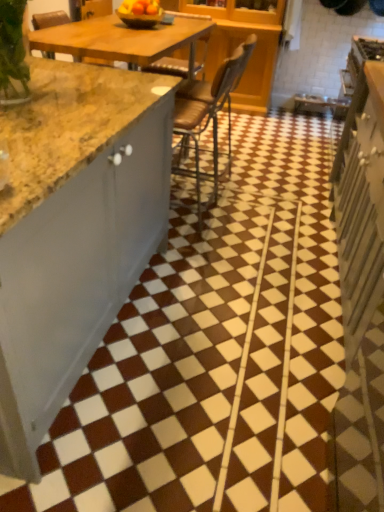
Question: Considering the relative positions of brown leather chair at center and matte yellow bowl at upper center in the image provided, is brown leather chair at center to the left of matte yellow bowl at upper center from the viewer's perspective?

Choices:
 (A) no
 (B) yes

Answer: (A)

Question: Are brown leather chair at center and matte yellow bowl at upper center far apart?

Choices:
 (A) no
 (B) yes

Answer: (B)

Question: Does brown leather chair at center have a lesser height compared to matte yellow bowl at upper center?

Choices:
 (A) no
 (B) yes

Answer: (A)

Question: From the image's perspective, would you say brown leather chair at center is shown under matte yellow bowl at upper center?

Choices:
 (A) no
 (B) yes

Answer: (B)

Question: Does brown leather chair at center have a smaller size compared to matte yellow bowl at upper center?

Choices:
 (A) yes
 (B) no

Answer: (B)

Question: Does brown leather chair at center have a lesser width compared to matte yellow bowl at upper center?

Choices:
 (A) no
 (B) yes

Answer: (A)

Question: Is brown glossy tile at center aimed at matte yellow bowl at upper center?

Choices:
 (A) no
 (B) yes

Answer: (A)

Question: Does brown glossy tile at center have a greater height compared to matte yellow bowl at upper center?

Choices:
 (A) yes
 (B) no

Answer: (A)

Question: Is brown glossy tile at center wider than matte yellow bowl at upper center?

Choices:
 (A) yes
 (B) no

Answer: (A)

Question: Would you say brown glossy tile at center is outside matte yellow bowl at upper center?

Choices:
 (A) no
 (B) yes

Answer: (B)

Question: Is brown glossy tile at center at the left side of matte yellow bowl at upper center?

Choices:
 (A) yes
 (B) no

Answer: (B)

Question: From the image's perspective, is brown glossy tile at center under matte yellow bowl at upper center?

Choices:
 (A) yes
 (B) no

Answer: (A)

Question: Does white glossy cabinet at right come behind brown glossy tile at center?

Choices:
 (A) no
 (B) yes

Answer: (A)